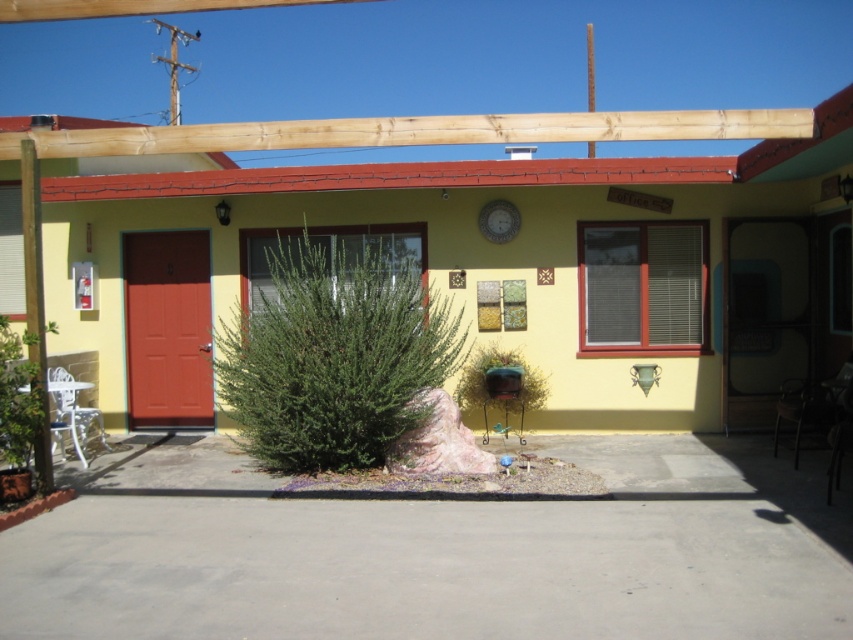
Consider the image. You are an architect designing a new building and want to ensure that the wooden pergola at upper center and the natural wood beam at upper center are visually balanced. Based on their heights, which one should be placed higher to achieve this balance?

The wooden pergola at upper center has a lesser height compared to natural wood beam at upper center, so to achieve visual balance, the natural wood beam at upper center should be placed higher to compensate for its greater height.

From the picture: You are standing in front of the building and notice two green items. One is the green leafy plant at lower left and the other is the green matte bird feeder at lower center. Which one is positioned more to the left side?

The green leafy plant at lower left is positioned more to the left side than the green matte bird feeder at lower center.

You are a delivery person trying to reach the front door of the building. There is a wooden pergola at upper center and a green leafy plant at lower left in your way. Can you walk between them without going around?

The wooden pergola at upper center is 3.54 meters away from the green leafy plant at lower left. Since the distance between them is sufficient, you can walk between them without needing to go around.